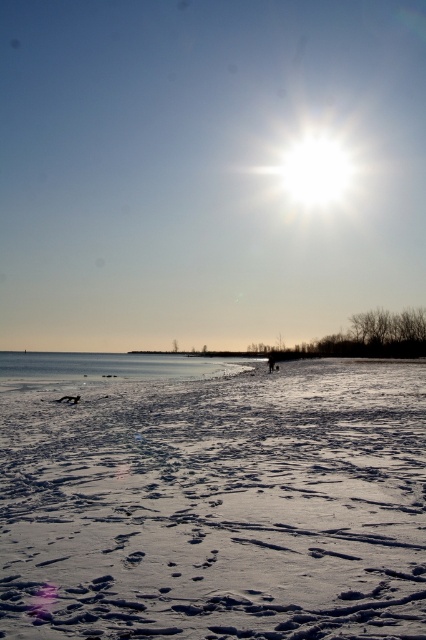
You are an ice fisherman preparing to set up your equipment. You see the white powdery snow at center and the clear ice lake at center. Which surface should you avoid stepping on to ensure safety?

You should avoid stepping on the clear ice lake at center because the white powdery snow at center is above it, indicating the snow is on top of the ice lake. The snow might be stable, but the ice lake could be thin or unsafe under the snow cover.